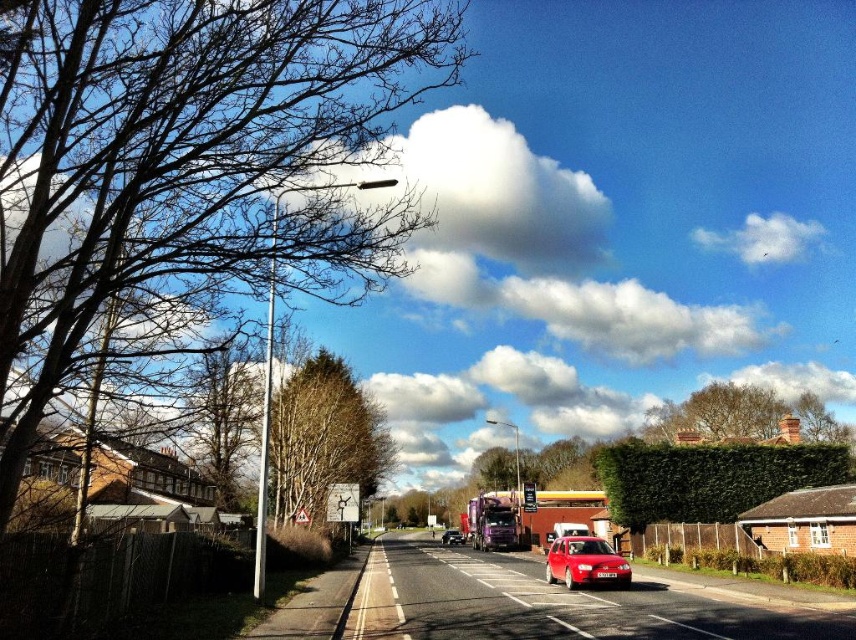
Question: Which object appears farthest from the camera in this image?

Choices:
 (A) green leafy hedge at center
 (B) bare branches at left

Answer: (A)

Question: Which point is farther to the camera?

Choices:
 (A) shiny red car at center
 (B) green leafy hedge at center

Answer: (B)

Question: Is smooth brown tree at center to the right of shiny red car at center from the viewer's perspective?

Choices:
 (A) no
 (B) yes

Answer: (A)

Question: Does smooth brown tree at center have a larger size compared to shiny red car at center?

Choices:
 (A) yes
 (B) no

Answer: (A)

Question: Is smooth brown tree at center smaller than metallic purple truck at center?

Choices:
 (A) yes
 (B) no

Answer: (B)

Question: Among these points, which one is nearest to the camera?

Choices:
 (A) (777, 406)
 (B) (288, 460)

Answer: (B)